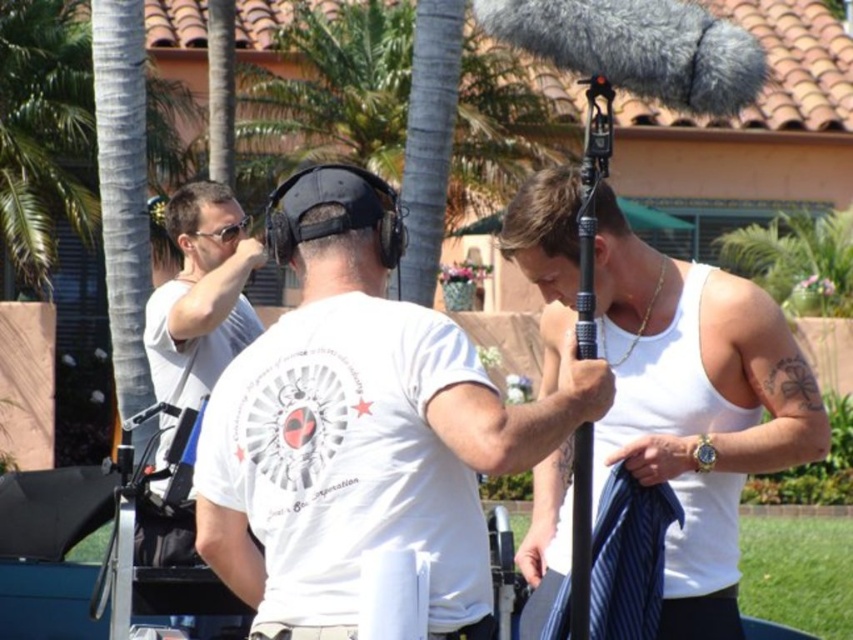
Can you confirm if white tank top at center is thinner than white matte shirt at left?

No.

Does point (689, 621) come farther from viewer compared to point (181, 288)?

No, it is in front of (181, 288).

At what (x,y) coordinates should I click in order to perform the action: click on white tank top at center. Please return your answer as a coordinate pair (x, y). The image size is (853, 640). Looking at the image, I should click on (695, 406).

Is white matte t-shirt at center bigger than white tank top at center?

Yes, white matte t-shirt at center is bigger than white tank top at center.

Is point (428, 465) positioned after point (703, 268)?

That is False.

At what (x,y) coordinates should I click in order to perform the action: click on white matte t-shirt at center. Please return your answer as a coordinate pair (x, y). This screenshot has height=640, width=853. Looking at the image, I should click on (360, 428).

Who is taller, white tank top at center or black plastic goggles at upper left?

white tank top at center

Which is more to the right, white tank top at center or black plastic goggles at upper left?

Positioned to the right is white tank top at center.

Between point (711, 346) and point (225, 240), which one is positioned in front?

Point (711, 346) is in front.

The height and width of the screenshot is (640, 853). I want to click on white tank top at center, so click(x=695, y=406).